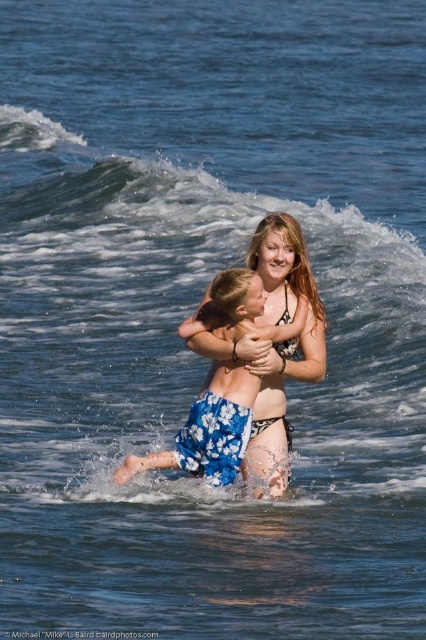
You are a photographer trying to capture the white foamy wave at upper center and the blue floral shorts at center in a single shot. Based on their positions, which object should you focus on first to ensure both are in frame?

The white foamy wave at upper center is located above the blue floral shorts at center, so you should focus on the white foamy wave at upper center first to ensure both are in frame.